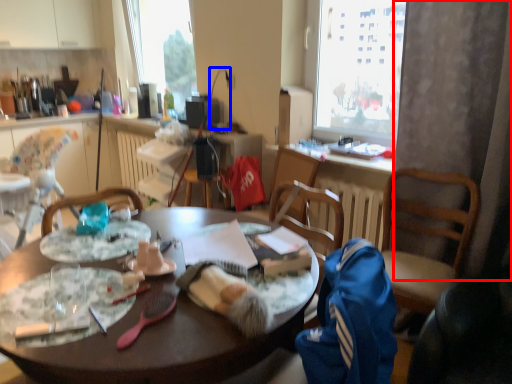
Question: Which point is closer to the camera, curtain (highlighted by a red box) or lamp (highlighted by a blue box)?

Choices:
 (A) curtain
 (B) lamp

Answer: (A)